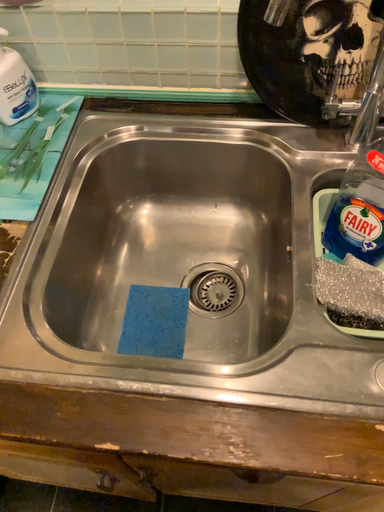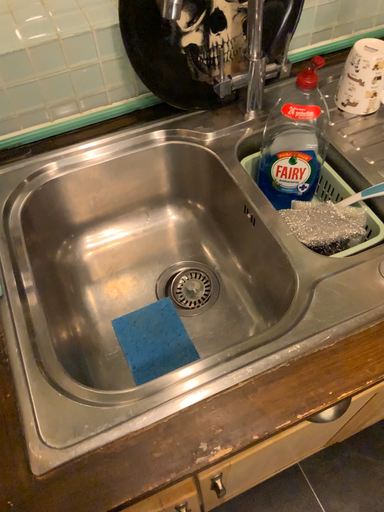
Question: How did the camera likely rotate when shooting the video?

Choices:
 (A) rotated left
 (B) rotated right

Answer: (B)